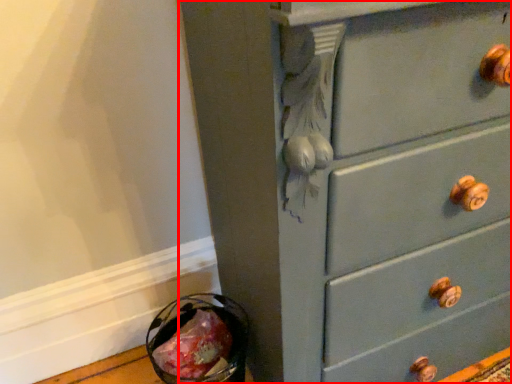
Question: Considering the relative positions of chest of drawers (annotated by the red box) and food in the image provided, where is chest of drawers (annotated by the red box) located with respect to the staircase?

Choices:
 (A) left
 (B) right

Answer: (B)